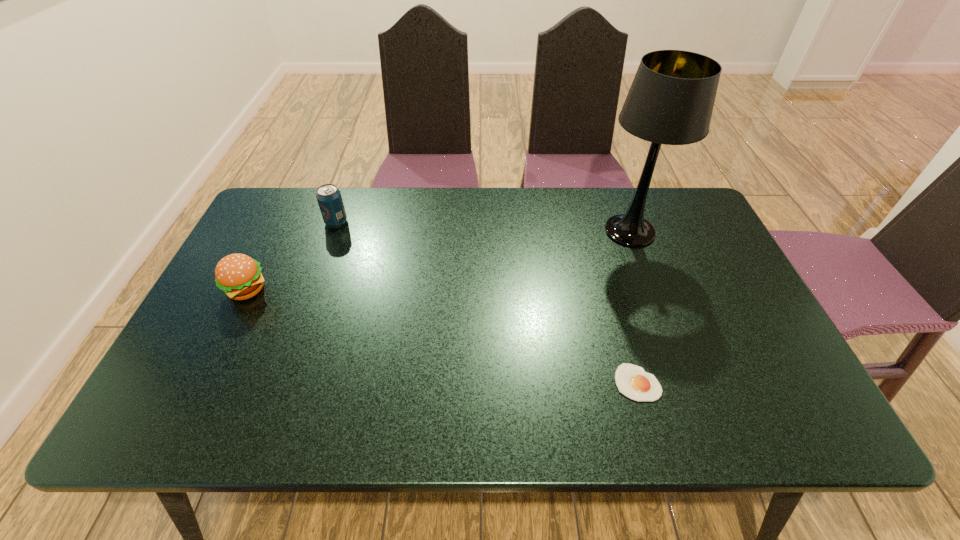
At what (x,y) coordinates should I click in order to perform the action: click on free space that is in between the pop soda and the table lamp. Please return your answer as a coordinate pair (x, y). The width and height of the screenshot is (960, 540). Looking at the image, I should click on (483, 227).

Identify the location of free space between the second nearest object and the nearest object. The height and width of the screenshot is (540, 960). (443, 336).

Where is `vacant area that lies between the table lamp and the hamburger`? This screenshot has height=540, width=960. vacant area that lies between the table lamp and the hamburger is located at coordinates (439, 260).

Where is `free spot between the second nearest object and the shortest object`? free spot between the second nearest object and the shortest object is located at coordinates (443, 336).

Identify the location of vacant point located between the third farthest object and the pop soda. (292, 256).

Image resolution: width=960 pixels, height=540 pixels. Find the location of `free spot between the tallest object and the leftmost object`. free spot between the tallest object and the leftmost object is located at coordinates (439, 260).

Locate an element on the screen. This screenshot has height=540, width=960. empty space between the table lamp and the egg yolk is located at coordinates (634, 307).

Find the location of a particular element. Image resolution: width=960 pixels, height=540 pixels. free spot between the leftmost object and the pop soda is located at coordinates (292, 256).

The height and width of the screenshot is (540, 960). What are the coordinates of `empty space that is in between the third object from right to left and the hamburger` in the screenshot? It's located at (292, 256).

At what (x,y) coordinates should I click in order to perform the action: click on vacant space in between the hamburger and the second object from left to right. Please return your answer as a coordinate pair (x, y). Looking at the image, I should click on (292, 256).